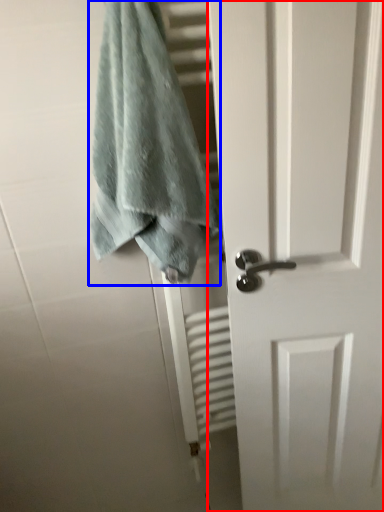
Question: Among these objects, which one is nearest to the camera, door (highlighted by a red box) or towel (highlighted by a blue box)?

Choices:
 (A) door
 (B) towel

Answer: (B)